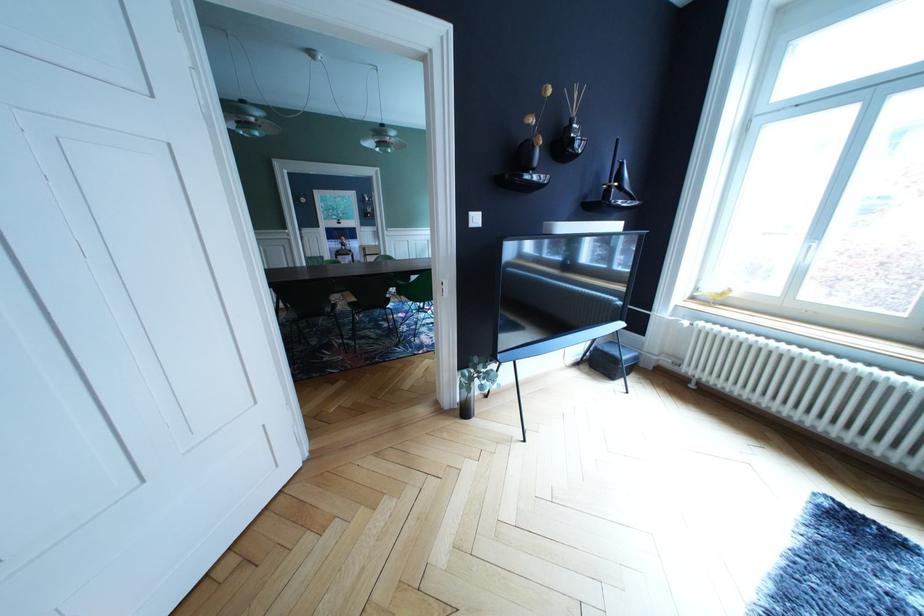
Find where to sit the black chair sitting surface. Please return your answer as a coordinate pair (x, y).

(310, 302)